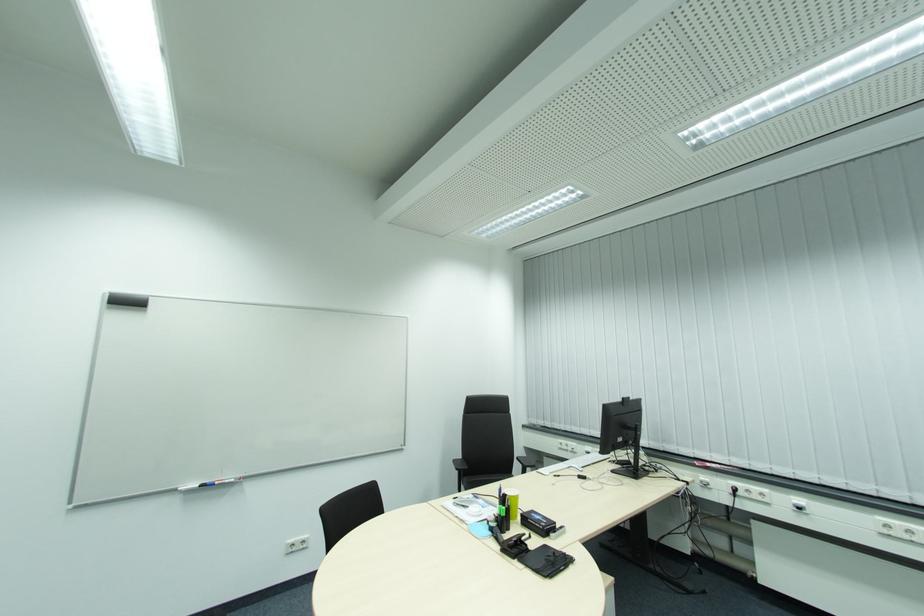
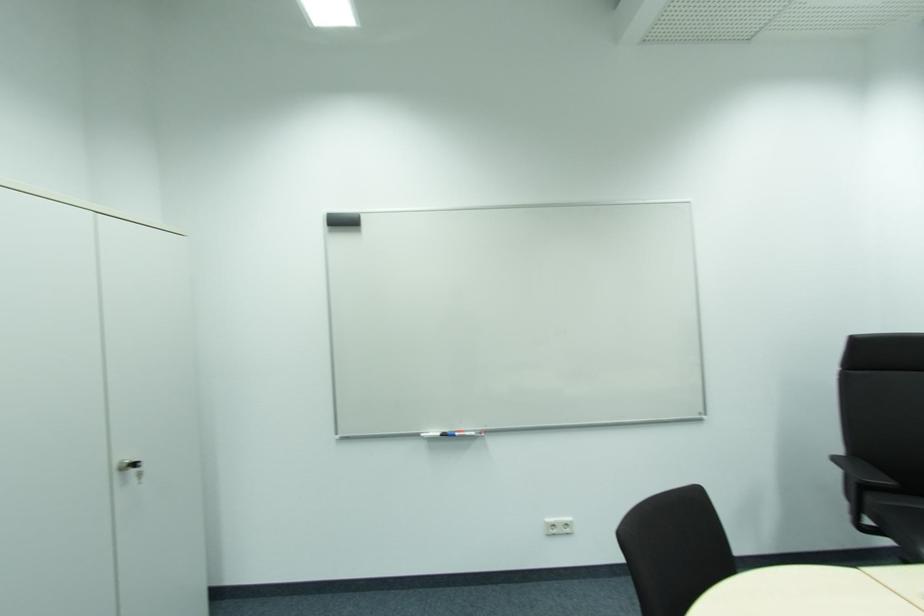
Where in the second image is the point corresponding to point 223,483 from the first image?

(464, 434)